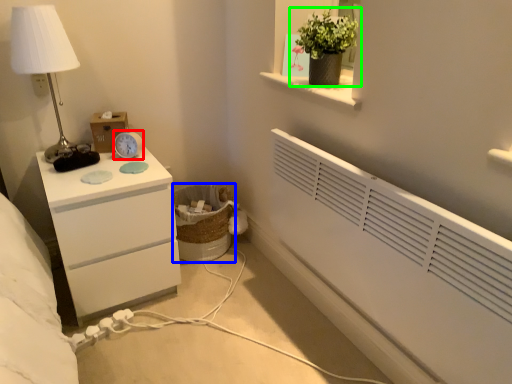
Question: Based on their relative distances, which object is nearer to alarm clock (highlighted by a red box)? Choose from laundry basket (highlighted by a blue box) and houseplant (highlighted by a green box).

Choices:
 (A) laundry basket
 (B) houseplant

Answer: (A)